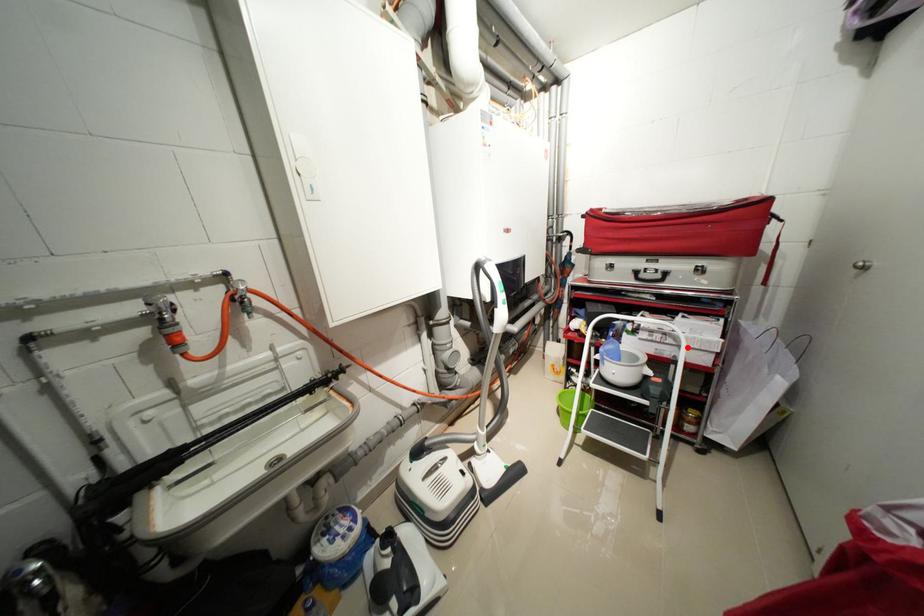
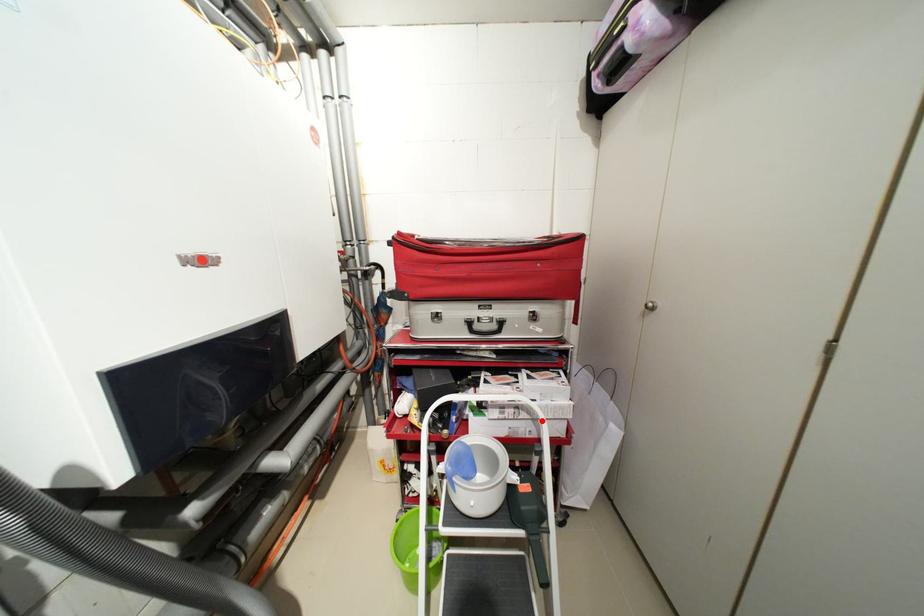
I am providing you with two images of the same scene from different viewpoints. A red point is marked on the first image and another point is marked on the second image. Is the marked point in image1 the same physical position as the marked point in image2?

Yes